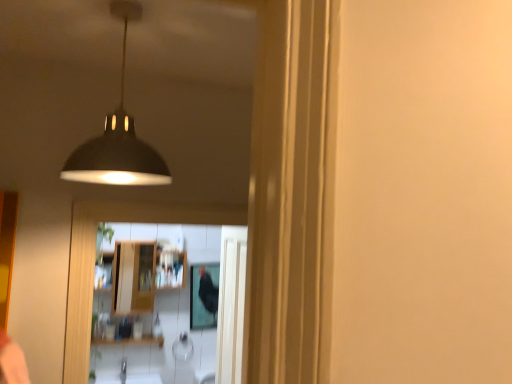
Where is `matte black lampshade at upper center`? Image resolution: width=512 pixels, height=384 pixels. matte black lampshade at upper center is located at coordinates (118, 137).

Describe the element at coordinates (118, 137) in the screenshot. I see `matte black lampshade at upper center` at that location.

This screenshot has height=384, width=512. What do you see at coordinates (204, 296) in the screenshot? I see `black glossy mirror at center` at bounding box center [204, 296].

Find the location of a particular element. The height and width of the screenshot is (384, 512). black glossy mirror at center is located at coordinates (204, 296).

The height and width of the screenshot is (384, 512). Find the location of `matte black lampshade at upper center`. matte black lampshade at upper center is located at coordinates (118, 137).

Is black glossy mirror at center to the left of matte black lampshade at upper center from the viewer's perspective?

No.

Considering the positions of objects black glossy mirror at center and matte black lampshade at upper center in the image provided, who is in front, black glossy mirror at center or matte black lampshade at upper center?

matte black lampshade at upper center is in front.

Is point (216, 263) farther from viewer compared to point (114, 9)?

Yes, it is behind point (114, 9).

From the image's perspective, is black glossy mirror at center on top of matte black lampshade at upper center?

Incorrect, from the image's perspective, black glossy mirror at center is lower than matte black lampshade at upper center.

From a real-world perspective, is black glossy mirror at center on top of matte black lampshade at upper center?

No.

Based on the photo, between black glossy mirror at center and matte black lampshade at upper center, which one has larger width?

With larger width is matte black lampshade at upper center.

Considering the sizes of objects black glossy mirror at center and matte black lampshade at upper center in the image provided, who is shorter, black glossy mirror at center or matte black lampshade at upper center?

Standing shorter between the two is matte black lampshade at upper center.

From the picture: Considering the sizes of objects black glossy mirror at center and matte black lampshade at upper center in the image provided, who is smaller, black glossy mirror at center or matte black lampshade at upper center?

With smaller size is black glossy mirror at center.

Is black glossy mirror at center inside or outside of matte black lampshade at upper center?

The correct answer is: outside.

Is black glossy mirror at center placed right next to matte black lampshade at upper center?

black glossy mirror at center and matte black lampshade at upper center are clearly separated.

From the picture: Does black glossy mirror at center turn towards matte black lampshade at upper center?

Yes, black glossy mirror at center is facing matte black lampshade at upper center.

Find the location of a particular element. lamp on the left of black glossy mirror at center is located at coordinates (118, 137).

In the scene shown: In the image, is matte black lampshade at upper center on the left side or the right side of black glossy mirror at center?

From the image, it's evident that matte black lampshade at upper center is to the left of black glossy mirror at center.

Is matte black lampshade at upper center in front of black glossy mirror at center?

Yes.

Is point (115, 148) closer to camera compared to point (205, 277)?

Yes, it is.

From the image's perspective, is matte black lampshade at upper center on black glossy mirror at center?

Yes, from the image's perspective, matte black lampshade at upper center is on top of black glossy mirror at center.

Looking at this image, from a real-world perspective, is matte black lampshade at upper center physically located above or below black glossy mirror at center?

matte black lampshade at upper center is above black glossy mirror at center.

Between matte black lampshade at upper center and black glossy mirror at center, which one has smaller width?

With smaller width is black glossy mirror at center.

Does matte black lampshade at upper center have a lesser height compared to black glossy mirror at center?

Yes, matte black lampshade at upper center is shorter than black glossy mirror at center.

Between matte black lampshade at upper center and black glossy mirror at center, which one has larger size?

Bigger between the two is matte black lampshade at upper center.

Can we say matte black lampshade at upper center lies outside black glossy mirror at center?

Absolutely, matte black lampshade at upper center is external to black glossy mirror at center.

Is matte black lampshade at upper center in contact with black glossy mirror at center?

No, matte black lampshade at upper center is not with black glossy mirror at center.

Does matte black lampshade at upper center turn towards black glossy mirror at center?

Yes, matte black lampshade at upper center is oriented towards black glossy mirror at center.

How many degrees apart are the facing directions of matte black lampshade at upper center and black glossy mirror at center?

178 degrees separate the facing orientations of matte black lampshade at upper center and black glossy mirror at center.

Find the location of a particular element. mirror lying below the matte black lampshade at upper center (from the image's perspective) is located at coordinates (204, 296).

Find the location of a particular element. mirror that appears below the matte black lampshade at upper center (from the image's perspective) is located at coordinates (204, 296).

Locate an element on the screen. The width and height of the screenshot is (512, 384). lamp in front of the black glossy mirror at center is located at coordinates (118, 137).